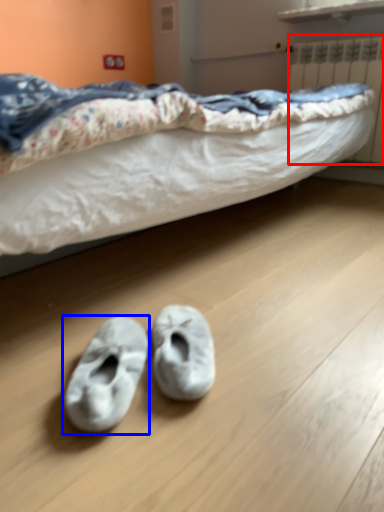
Question: Which object appears farthest to the camera in this image, radiator (highlighted by a red box) or footwear (highlighted by a blue box)?

Choices:
 (A) radiator
 (B) footwear

Answer: (A)